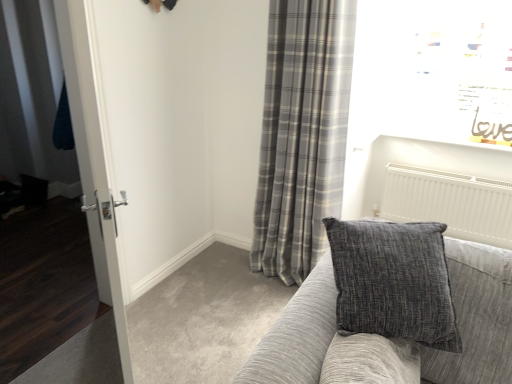
Question: Is gray plaid curtain at center facing away from white glossy door at left?

Choices:
 (A) no
 (B) yes

Answer: (A)

Question: Does gray plaid curtain at center have a lesser width compared to white glossy door at left?

Choices:
 (A) no
 (B) yes

Answer: (A)

Question: Is white glossy door at left located within gray plaid curtain at center?

Choices:
 (A) no
 (B) yes

Answer: (A)

Question: Is gray plaid curtain at center placed right next to white glossy door at left?

Choices:
 (A) yes
 (B) no

Answer: (B)

Question: Is gray plaid curtain at center closer to camera compared to white glossy door at left?

Choices:
 (A) yes
 (B) no

Answer: (B)

Question: Does gray plaid curtain at center have a larger size compared to white glossy door at left?

Choices:
 (A) no
 (B) yes

Answer: (B)

Question: Is textured gray couch at center further to the viewer compared to gray plaid curtain at center?

Choices:
 (A) yes
 (B) no

Answer: (B)

Question: From a real-world perspective, is textured gray couch at center physically above gray plaid curtain at center?

Choices:
 (A) no
 (B) yes

Answer: (A)

Question: Is textured gray couch at center to the right of gray plaid curtain at center from the viewer's perspective?

Choices:
 (A) no
 (B) yes

Answer: (B)

Question: Does textured gray couch at center have a lesser width compared to gray plaid curtain at center?

Choices:
 (A) no
 (B) yes

Answer: (A)

Question: Is textured gray couch at center oriented towards gray plaid curtain at center?

Choices:
 (A) yes
 (B) no

Answer: (B)

Question: Does textured gray couch at center have a greater width compared to gray plaid curtain at center?

Choices:
 (A) no
 (B) yes

Answer: (B)

Question: Does textured gray couch at center appear on the left side of white glossy door at left?

Choices:
 (A) yes
 (B) no

Answer: (B)